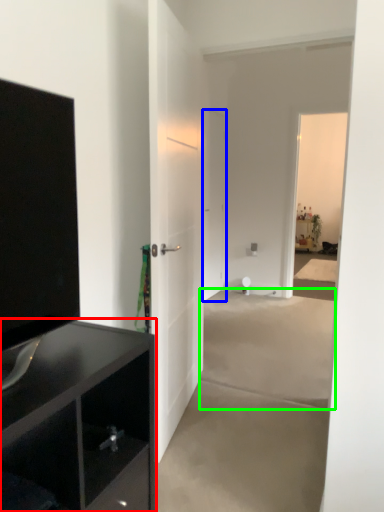
Question: Which object is the farthest from cabinetry (highlighted by a red box)? Choose among these: door (highlighted by a blue box) or concrete (highlighted by a green box).

Choices:
 (A) door
 (B) concrete

Answer: (A)